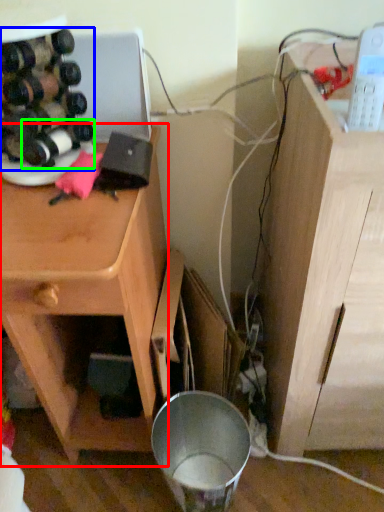
Question: Estimate the real-world distances between objects in this image. Which object is farther from cabinetry (highlighted by a red box), wine bottle (highlighted by a blue box) or wine bottle (highlighted by a green box)?

Choices:
 (A) wine bottle
 (B) wine bottle

Answer: (B)